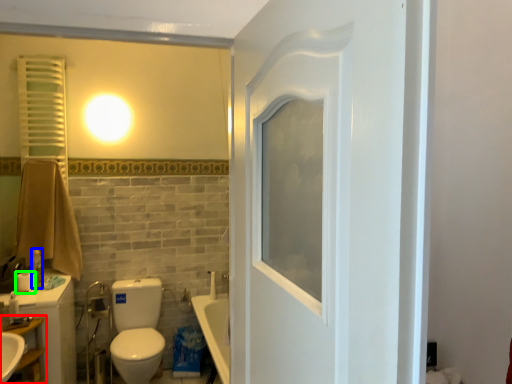
Question: Based on their relative distances, which object is nearer to shelf (highlighted by a red box)? Choose from toiletry (highlighted by a blue box) and toilet paper (highlighted by a green box).

Choices:
 (A) toiletry
 (B) toilet paper

Answer: (B)